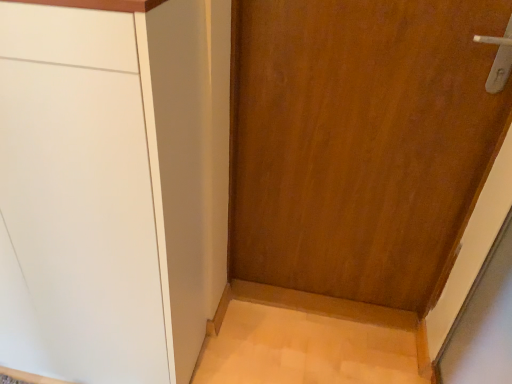
Question: Is matte white cabinet at left taller than wooden door at center?

Choices:
 (A) yes
 (B) no

Answer: (A)

Question: Considering the relative sizes of matte white cabinet at left and wooden door at center in the image provided, is matte white cabinet at left thinner than wooden door at center?

Choices:
 (A) yes
 (B) no

Answer: (B)

Question: Is matte white cabinet at left oriented away from wooden door at center?

Choices:
 (A) yes
 (B) no

Answer: (B)

Question: From a real-world perspective, is matte white cabinet at left physically below wooden door at center?

Choices:
 (A) no
 (B) yes

Answer: (A)

Question: Considering the relative positions of matte white cabinet at left and wooden door at center in the image provided, is matte white cabinet at left to the left of wooden door at center from the viewer's perspective?

Choices:
 (A) no
 (B) yes

Answer: (B)

Question: Is matte white cabinet at left positioned beyond the bounds of wooden door at center?

Choices:
 (A) yes
 (B) no

Answer: (A)

Question: Considering the relative sizes of wooden door at center and matte white cabinet at left in the image provided, is wooden door at center wider than matte white cabinet at left?

Choices:
 (A) yes
 (B) no

Answer: (B)

Question: Does wooden door at center come behind matte white cabinet at left?

Choices:
 (A) yes
 (B) no

Answer: (A)

Question: Is the depth of wooden door at center less than that of matte white cabinet at left?

Choices:
 (A) no
 (B) yes

Answer: (A)

Question: Does wooden door at center appear on the right side of matte white cabinet at left?

Choices:
 (A) yes
 (B) no

Answer: (A)

Question: Does wooden door at center have a smaller size compared to matte white cabinet at left?

Choices:
 (A) no
 (B) yes

Answer: (B)

Question: Does wooden door at center have a larger size compared to matte white cabinet at left?

Choices:
 (A) yes
 (B) no

Answer: (B)

Question: In terms of size, does wooden door at center appear bigger or smaller than matte white cabinet at left?

Choices:
 (A) small
 (B) big

Answer: (A)